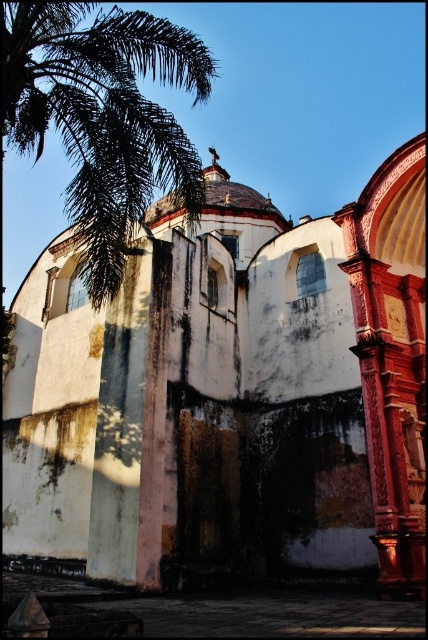
You are standing in front of the historic building described in the scene. There is a point marked at coordinates (228, 396). What does this point indicate?

The point at coordinates (228, 396) indicates the location of the white weathered stone church at center.

You are standing in front of the image and want to take a photo of the white weathered stone church at center and the green leafy palm at upper left. Which object should you frame first in your camera viewfinder to ensure both are in the shot?

You should frame the green leafy palm at upper left first because the white weathered stone church at center is positioned on the right side of it, so starting with the palm will allow you to include both in the frame.

Looking at this image, you are an architect analyzing the proportions of the white weathered stone church at center and the green leafy palm at upper left in the image. Which object appears narrower in the image?

The white weathered stone church at center is thinner than the green leafy palm at upper left, so the white weathered stone church at center appears narrower.